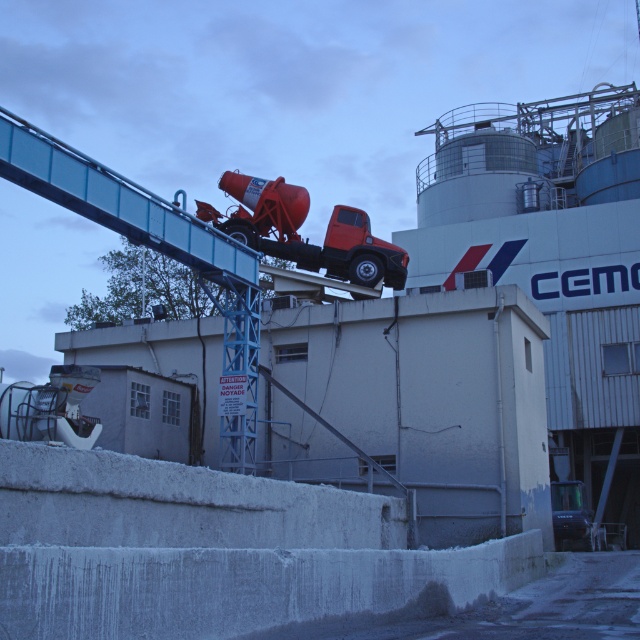
Question: Can you confirm if matte orange concrete mixer at upper center is positioned below metallic gray truck at lower right?

Choices:
 (A) no
 (B) yes

Answer: (A)

Question: Which point is farther to the camera?

Choices:
 (A) matte orange concrete mixer at upper center
 (B) metallic gray truck at lower right

Answer: (B)

Question: Does matte orange concrete mixer at upper center appear over metallic gray truck at lower right?

Choices:
 (A) yes
 (B) no

Answer: (A)

Question: Does matte orange concrete mixer at upper center have a lesser width compared to metallic gray truck at lower right?

Choices:
 (A) no
 (B) yes

Answer: (A)

Question: Which point is farther to the camera?

Choices:
 (A) metallic gray truck at lower right
 (B) matte orange concrete mixer at upper center

Answer: (A)